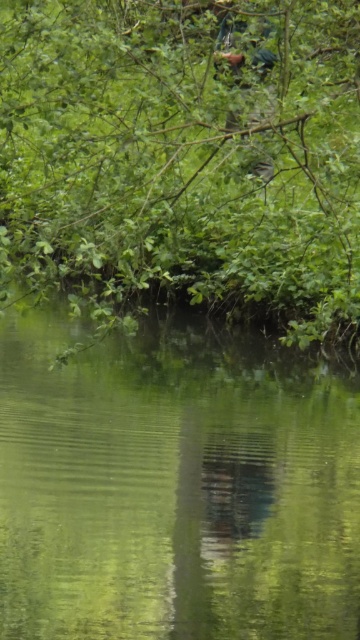
You are standing at the edge of a forest path and see the green reflective water at center. If you want to reach it, how many steps would you need to take, assuming each step covers about 2.5 feet?

The green reflective water at center is 17.65 feet away from viewer. Dividing 17.65 by 2.5 gives approximately 7.06 steps. Since you can only take whole steps, you would need to take 8 steps to reach the green reflective water at center.